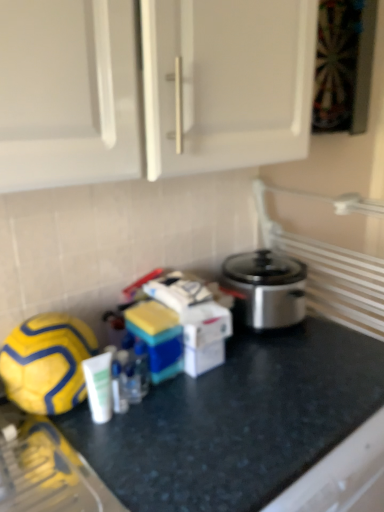
This screenshot has height=512, width=384. I want to click on yellow matte football at lower left, so click(x=47, y=362).

What do you see at coordinates (47, 362) in the screenshot? I see `yellow matte football at lower left` at bounding box center [47, 362].

Describe the element at coordinates (288, 384) in the screenshot. This screenshot has width=384, height=512. I see `black granite countertop at center` at that location.

Locate an element on the screen. The height and width of the screenshot is (512, 384). black granite countertop at center is located at coordinates (288, 384).

Image resolution: width=384 pixels, height=512 pixels. I want to click on yellow matte football at lower left, so click(47, 362).

Is yellow matte football at lower left at the right side of black granite countertop at center?

No.

Which object is more forward, yellow matte football at lower left or black granite countertop at center?

black granite countertop at center is closer to the camera.

Which is behind, point (52, 365) or point (263, 356)?

Positioned behind is point (263, 356).

From the image's perspective, is yellow matte football at lower left over black granite countertop at center?

Yes, from the image's perspective, yellow matte football at lower left is over black granite countertop at center.

From a real-world perspective, is yellow matte football at lower left positioned over black granite countertop at center based on gravity?

Yes, from a real-world perspective, yellow matte football at lower left is on top of black granite countertop at center.

Can you confirm if yellow matte football at lower left is wider than black granite countertop at center?

Incorrect, the width of yellow matte football at lower left does not surpass that of black granite countertop at center.

Is yellow matte football at lower left taller than black granite countertop at center?

No.

Is yellow matte football at lower left smaller than black granite countertop at center?

Correct, yellow matte football at lower left occupies less space than black granite countertop at center.

Is yellow matte football at lower left inside or outside of black granite countertop at center?

yellow matte football at lower left lies outside black granite countertop at center.

Is yellow matte football at lower left placed right next to black granite countertop at center?

No, yellow matte football at lower left is not beside black granite countertop at center.

Is yellow matte football at lower left oriented away from black granite countertop at center?

yellow matte football at lower left is not turned away from black granite countertop at center.

How many degrees apart are the facing directions of yellow matte football at lower left and black granite countertop at center?

The angular difference between yellow matte football at lower left and black granite countertop at center is 2.48 degrees.

The height and width of the screenshot is (512, 384). In order to click on football located above the black granite countertop at center (from a real-world perspective) in this screenshot , I will do `click(47, 362)`.

Can you confirm if black granite countertop at center is positioned to the left of yellow matte football at lower left?

In fact, black granite countertop at center is to the right of yellow matte football at lower left.

Is black granite countertop at center in front of or behind yellow matte football at lower left in the image?

Clearly, black granite countertop at center is in front of yellow matte football at lower left.

Based on the photo, which is closer, (x=119, y=423) or (x=59, y=390)?

Clearly, point (x=119, y=423) is more distant from the camera than point (x=59, y=390).

From the image's perspective, would you say black granite countertop at center is shown under yellow matte football at lower left?

Correct, black granite countertop at center appears lower than yellow matte football at lower left in the image.

From a real-world perspective, is black granite countertop at center under yellow matte football at lower left?

Yes, from a real-world perspective, black granite countertop at center is below yellow matte football at lower left.

Consider the image. Does black granite countertop at center have a lesser width compared to yellow matte football at lower left?

No.

Considering the sizes of black granite countertop at center and yellow matte football at lower left in the image, is black granite countertop at center taller or shorter than yellow matte football at lower left?

Clearly, black granite countertop at center is taller compared to yellow matte football at lower left.

Who is smaller, black granite countertop at center or yellow matte football at lower left?

yellow matte football at lower left.

Is black granite countertop at center outside of yellow matte football at lower left?

Indeed, black granite countertop at center is completely outside yellow matte football at lower left.

Based on the photo, does black granite countertop at center touch yellow matte football at lower left?

No, black granite countertop at center is not with yellow matte football at lower left.

Could you tell me if black granite countertop at center is facing yellow matte football at lower left?

No, black granite countertop at center is not oriented towards yellow matte football at lower left.

How different are the orientations of black granite countertop at center and yellow matte football at lower left in degrees?

The angle between the facing direction of black granite countertop at center and the facing direction of yellow matte football at lower left is 2.48 degrees.

Where is `football above the black granite countertop at center (from the image's perspective)`? The image size is (384, 512). football above the black granite countertop at center (from the image's perspective) is located at coordinates (47, 362).

Identify the location of counter on the right of yellow matte football at lower left. (288, 384).

Find the location of a particular element. football lying above the black granite countertop at center (from the image's perspective) is located at coordinates (47, 362).